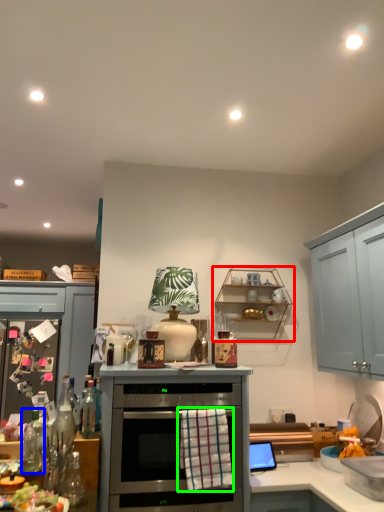
Question: Which object is the closest to the shelf (highlighted by a red box)? Choose among these: bottle (highlighted by a blue box) or material (highlighted by a green box).

Choices:
 (A) bottle
 (B) material

Answer: (B)